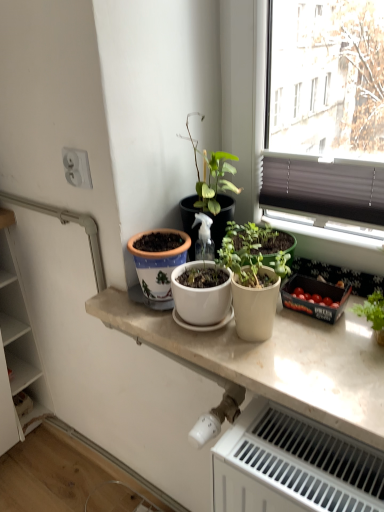
Locate an element on the screen. The height and width of the screenshot is (512, 384). vacant space situated above white matte countertop at center (from a real-world perspective) is located at coordinates (284, 334).